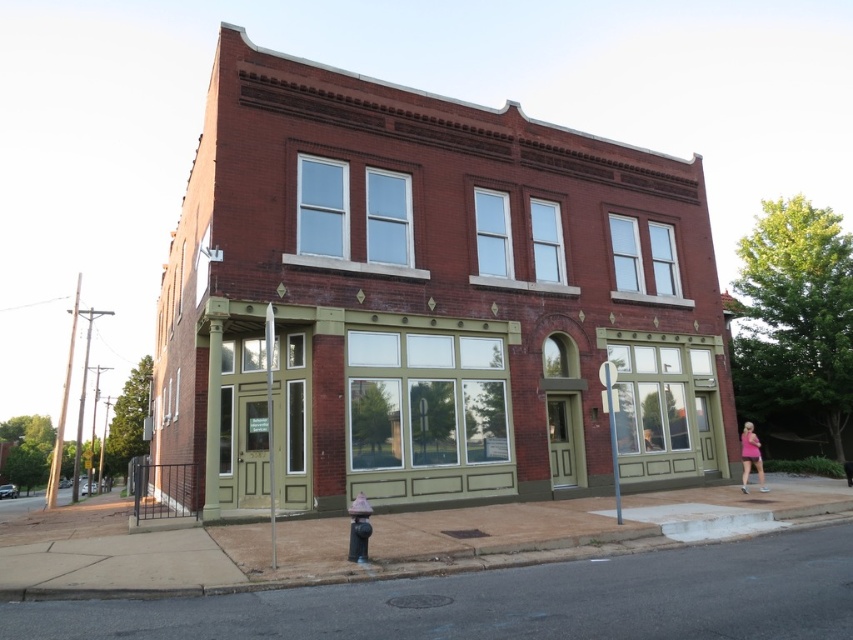
Does brick building at center have a lesser width compared to pink fabric dress at lower right?

Result: No, brick building at center is not thinner than pink fabric dress at lower right.

This screenshot has height=640, width=853. What do you see at coordinates (428, 298) in the screenshot?
I see `brick building at center` at bounding box center [428, 298].

Identify the location of brick building at center. (428, 298).